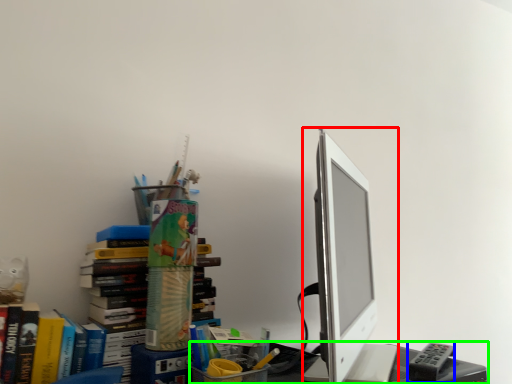
Question: Which object is positioned closest to computer monitor (highlighted by a red box)? Select from stationery (highlighted by a blue box) and desk (highlighted by a green box).

Choices:
 (A) stationery
 (B) desk

Answer: (B)